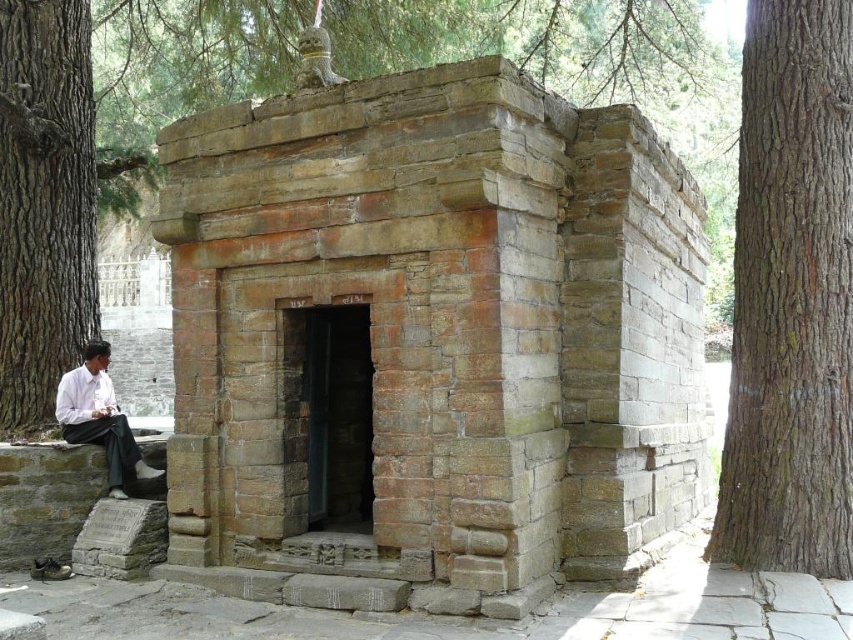
Question: Which point appears farthest from the camera in this image?

Choices:
 (A) (91, 436)
 (B) (74, 340)

Answer: (B)

Question: Which point is closer to the camera?

Choices:
 (A) (285, 250)
 (B) (827, 170)
 (C) (113, 419)
 (D) (67, 88)

Answer: (B)

Question: Does rustic stone hut at center appear over brown rough bark tree at left?

Choices:
 (A) yes
 (B) no

Answer: (B)

Question: Can you confirm if brown rough bark tree at right is positioned above white shirt at lower left?

Choices:
 (A) yes
 (B) no

Answer: (A)

Question: Which object is positioned closest to the white shirt at lower left?

Choices:
 (A) brown rough bark tree at left
 (B) brown rough bark tree at right

Answer: (A)

Question: From the image, what is the correct spatial relationship of brown rough bark tree at left in relation to white shirt at lower left?

Choices:
 (A) below
 (B) above

Answer: (B)